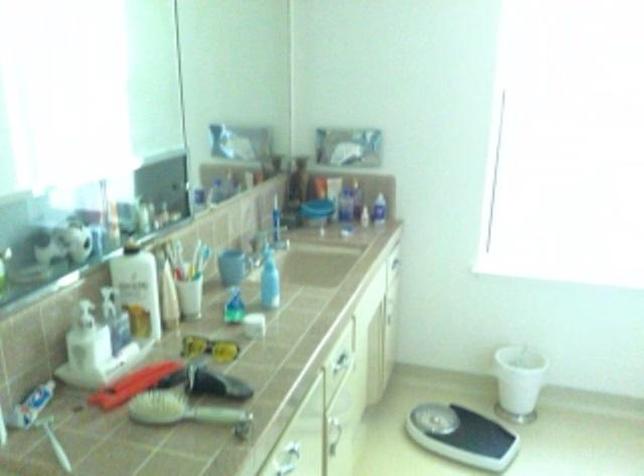
The location [31,406] corresponds to which object?

It refers to a tube of toothpaste.